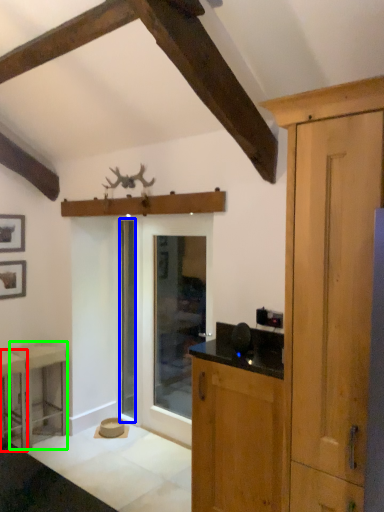
Question: Considering the real-world distances, which object is closest to stool (highlighted by a red box)? screen door (highlighted by a blue box) or stool (highlighted by a green box).

Choices:
 (A) screen door
 (B) stool

Answer: (B)